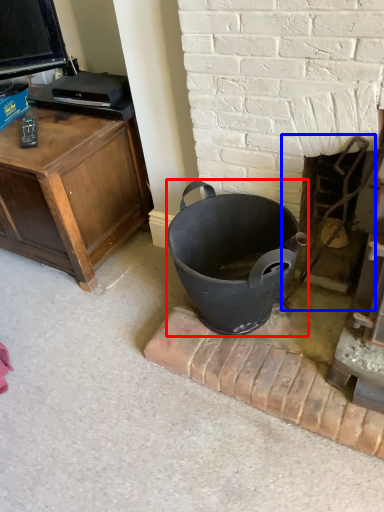
Question: Among these objects, which one is farthest to the camera, trash bin/can (highlighted by a red box) or fireplace (highlighted by a blue box)?

Choices:
 (A) trash bin/can
 (B) fireplace

Answer: (B)